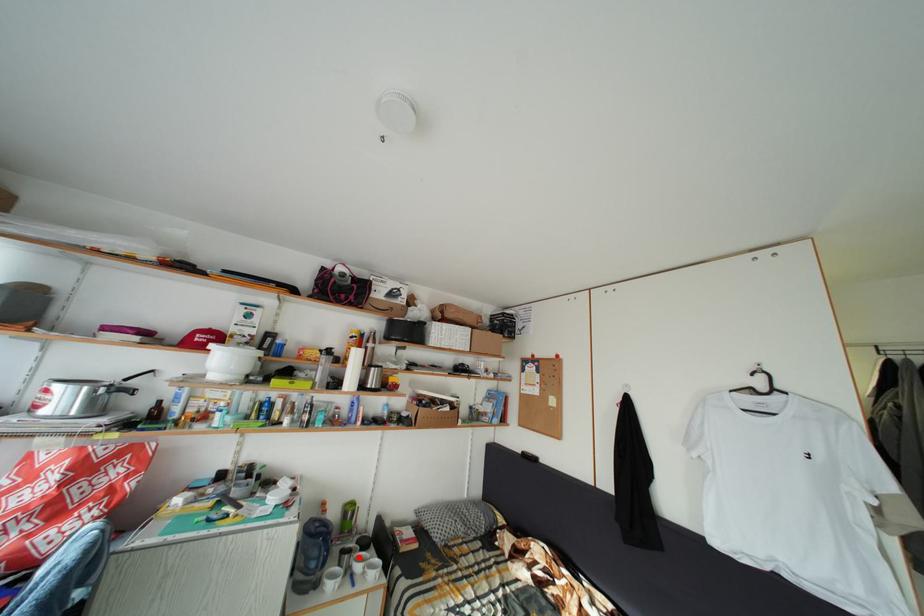
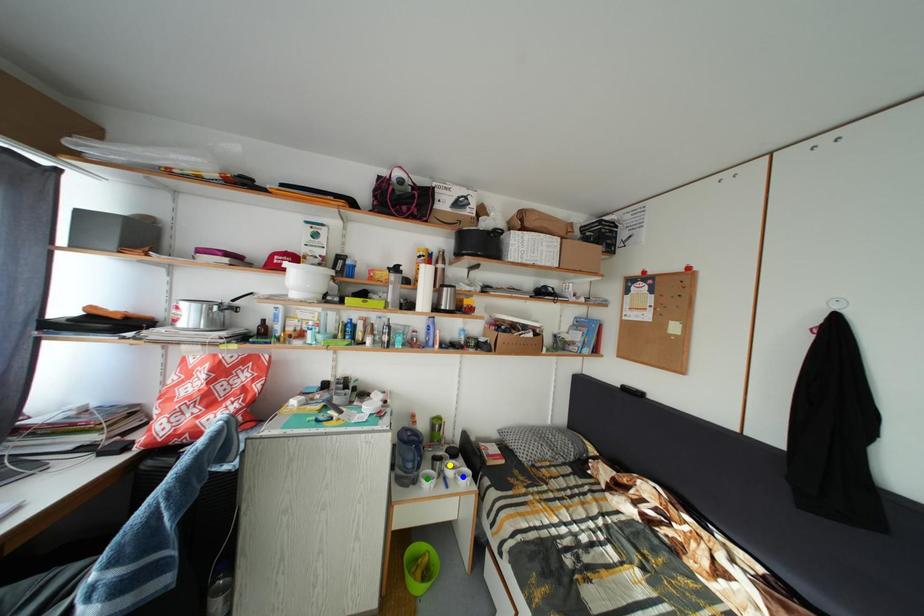
Question: I am providing you with two images of the same scene from different viewpoints. A red point is marked on the first image. You are given multiple points on the second image. In image 2, which mark is for the same physical point as the one in image 1?

Choices:
 (A) green point
 (B) blue point
 (C) yellow point

Answer: (C)